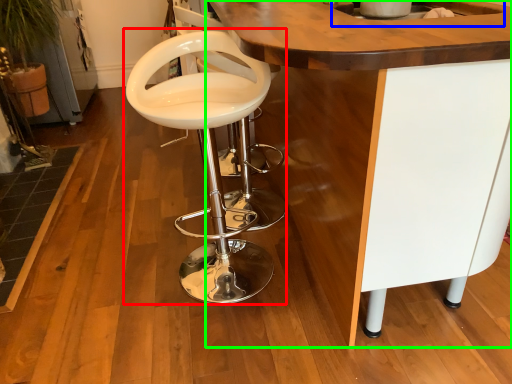
Question: Which object is the farthest from chair (highlighted by a red box)? Choose among these: sink (highlighted by a blue box) or table (highlighted by a green box).

Choices:
 (A) sink
 (B) table

Answer: (A)